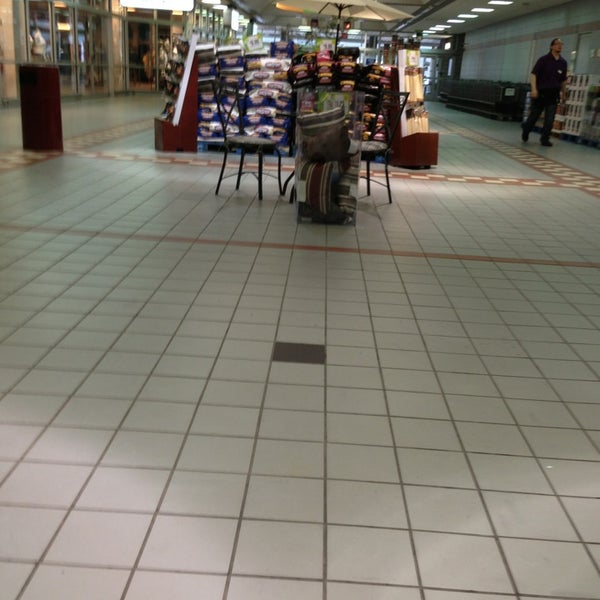
Find the location of `dining chairs`. dining chairs is located at coordinates (244, 144), (373, 145).